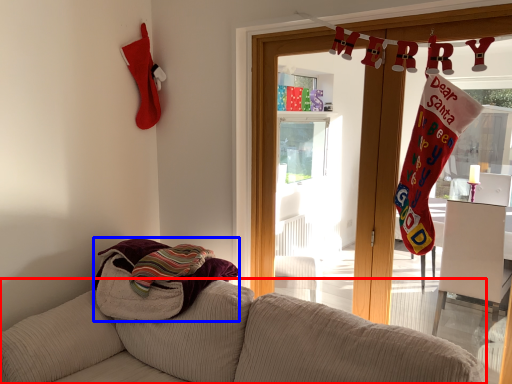
Question: Which of the following is the farthest to the observer, studio couch (highlighted by a red box) or beach towel (highlighted by a blue box)?

Choices:
 (A) studio couch
 (B) beach towel

Answer: (B)